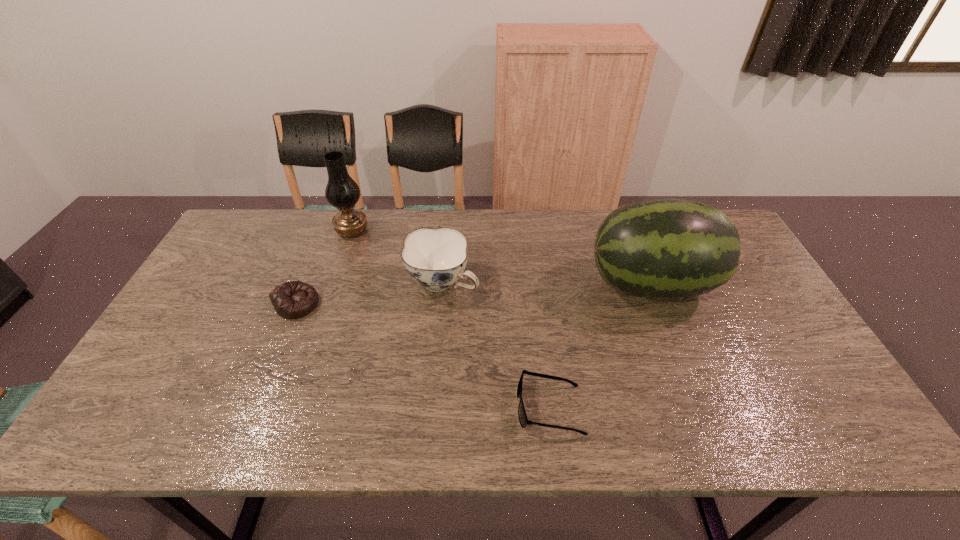
In order to click on free space at the left edge of the desktop in this screenshot , I will do 247,272.

Identify the location of vacant space at the right edge. (746, 275).

Locate an element on the screen. vacant space that's between the rightmost object and the third tallest object is located at coordinates (546, 284).

At what (x,y) coordinates should I click in order to perform the action: click on vacant region between the farthest object and the chinaware. Please return your answer as a coordinate pair (x, y). The height and width of the screenshot is (540, 960). Looking at the image, I should click on (397, 256).

You are a GUI agent. You are given a task and a screenshot of the screen. Output one action in this format:
    pyautogui.click(x=<x>, y=<y>)
    Task: Click on the vacant area that lies between the second object from right to left and the oil lamp
    
    Given the screenshot: What is the action you would take?
    pyautogui.click(x=451, y=319)

This screenshot has width=960, height=540. Find the location of `vacant region between the beanbag and the third object from right to left`. vacant region between the beanbag and the third object from right to left is located at coordinates (370, 293).

The image size is (960, 540). In order to click on vacant region between the beanbag and the nearest object in this screenshot , I will do `click(423, 356)`.

I want to click on blank region between the rightmost object and the second object from right to left, so click(x=600, y=346).

Image resolution: width=960 pixels, height=540 pixels. I want to click on vacant space that's between the rightmost object and the farthest object, so click(x=501, y=258).

Identify the location of empty space between the farthest object and the sunglasses. (451, 319).